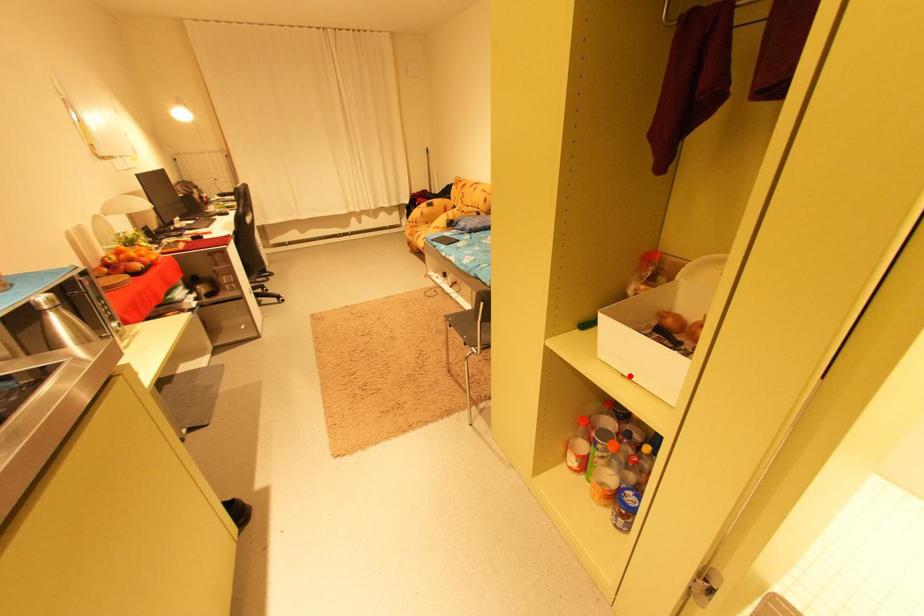
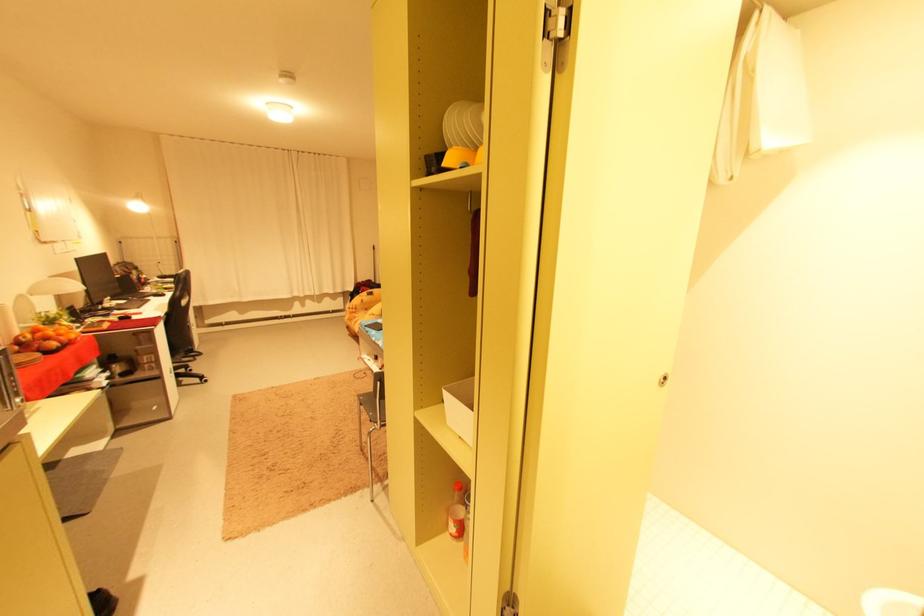
In the second image, find the point that corresponds to the highlighted location in the first image.

(467, 438)